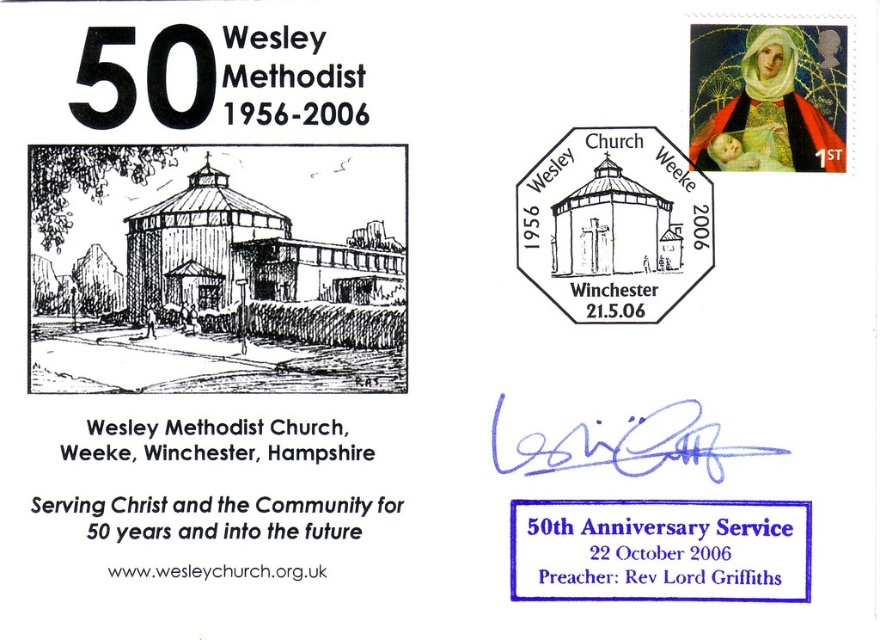
Question: Which point is closer to the camera?

Choices:
 (A) (625, 452)
 (B) (629, 556)

Answer: (B)

Question: Does blue ink signature at lower center appear on the right side of blue ink signature at center?

Choices:
 (A) no
 (B) yes

Answer: (B)

Question: Which of the following is the farthest from the observer?

Choices:
 (A) blue ink signature at lower center
 (B) white paper stamp at upper center
 (C) blue ink signature at center

Answer: (B)

Question: Estimate the real-world distances between objects in this image. Which object is farther from the blue ink signature at lower center?

Choices:
 (A) blue ink signature at center
 (B) white paper stamp at upper center

Answer: (B)

Question: Can you confirm if white paper stamp at upper center is positioned above blue ink signature at lower center?

Choices:
 (A) yes
 (B) no

Answer: (A)

Question: Does white paper stamp at upper center have a lesser width compared to blue ink signature at center?

Choices:
 (A) yes
 (B) no

Answer: (A)